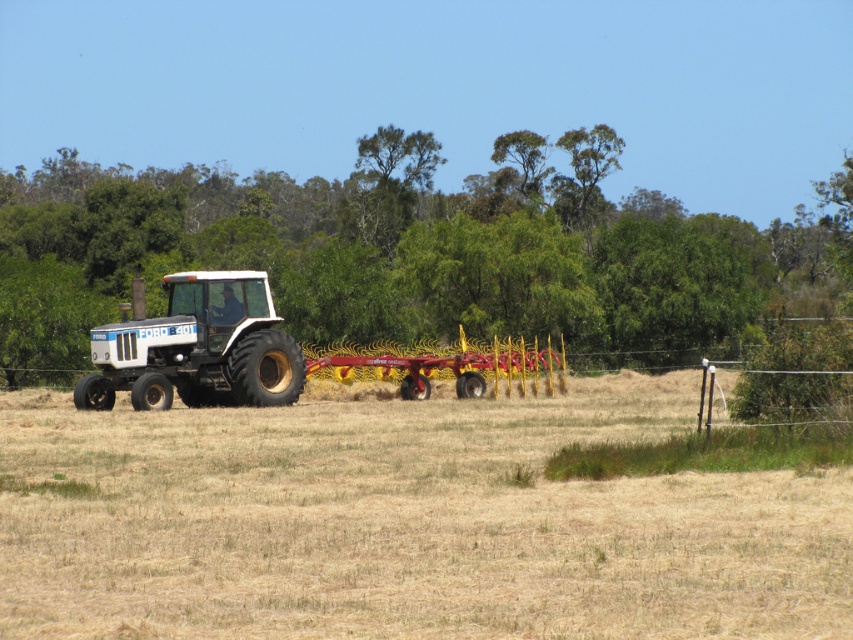
Which is more to the left, dry straw at center or white matte tractor at left?

From the viewer's perspective, white matte tractor at left appears more on the left side.

Can you confirm if dry straw at center is taller than white matte tractor at left?

Incorrect, dry straw at center's height is not larger of white matte tractor at left's.

Is point (558, 612) positioned behind point (122, 342)?

No, it is in front of (122, 342).

Locate an element on the screen. The width and height of the screenshot is (853, 640). dry straw at center is located at coordinates (403, 522).

Is point (633, 497) more distant than point (257, 381)?

That is False.

Does dry straw at center have a greater width compared to white matte tractor at center?

Correct, the width of dry straw at center exceeds that of white matte tractor at center.

Between point (206, 451) and point (131, 324), which one is positioned behind?

Point (131, 324)

You are a GUI agent. You are given a task and a screenshot of the screen. Output one action in this format:
    pyautogui.click(x=<x>, y=<y>)
    Task: Click on the dry straw at center
    The image size is (853, 640).
    Given the screenshot: What is the action you would take?
    (403, 522)

Which is below, white matte tractor at center or white matte tractor at left?

Positioned lower is white matte tractor at left.

Which is behind, point (421, 381) or point (190, 371)?

Point (421, 381)

Find the location of `white matte tractor at center`. white matte tractor at center is located at coordinates (231, 352).